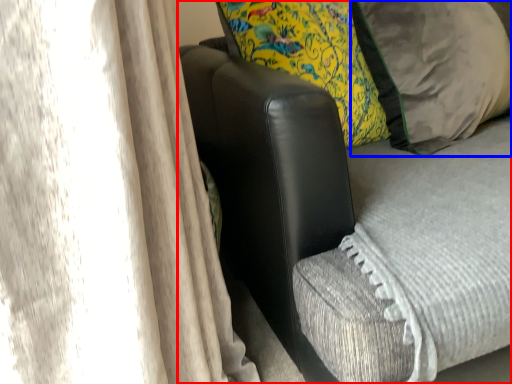
Question: Which of the following is the farthest to the observer, furniture (highlighted by a red box) or pillow (highlighted by a blue box)?

Choices:
 (A) furniture
 (B) pillow

Answer: (B)